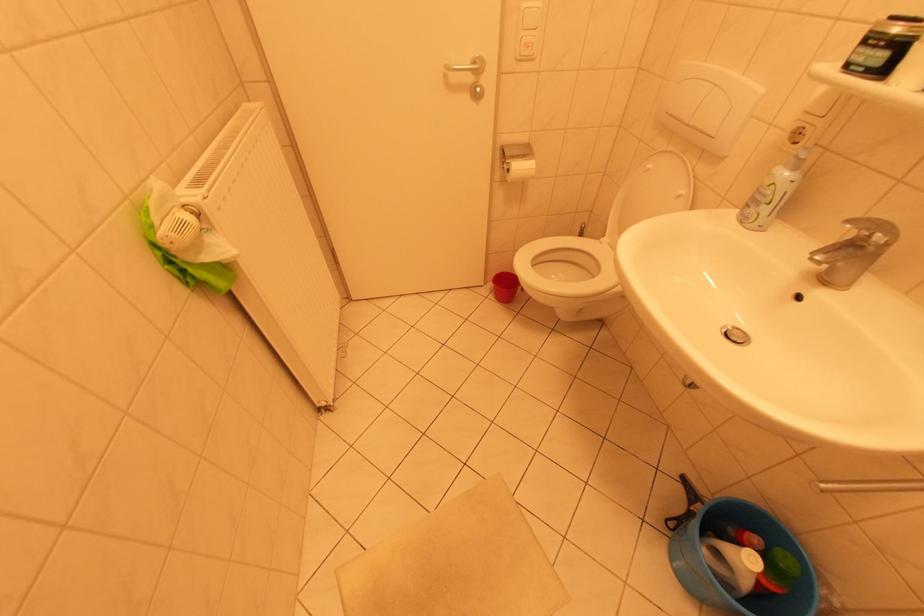
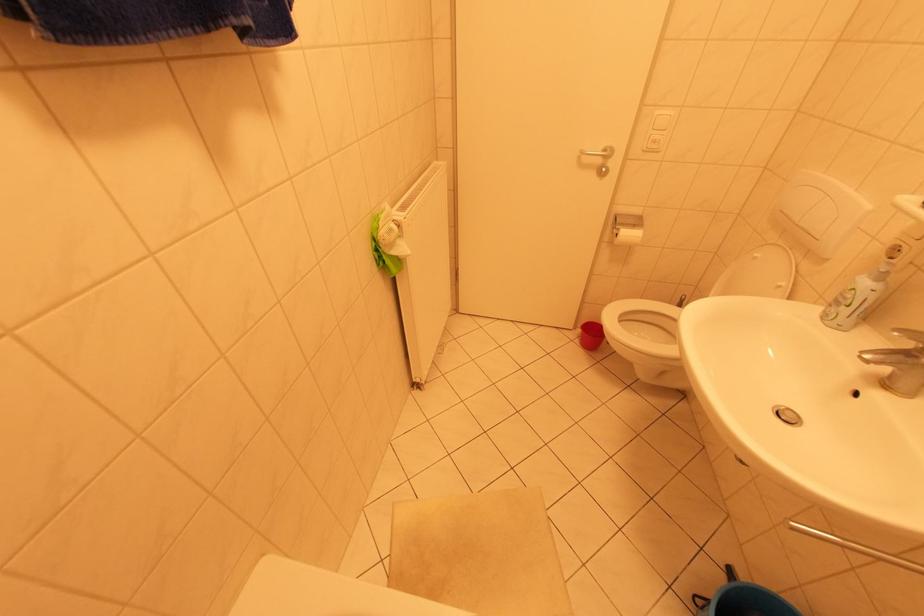
Question: What movement of the cameraman would produce the second image?

Choices:
 (A) Left
 (B) Right
 (C) Forward
 (D) Backward

Answer: (D)